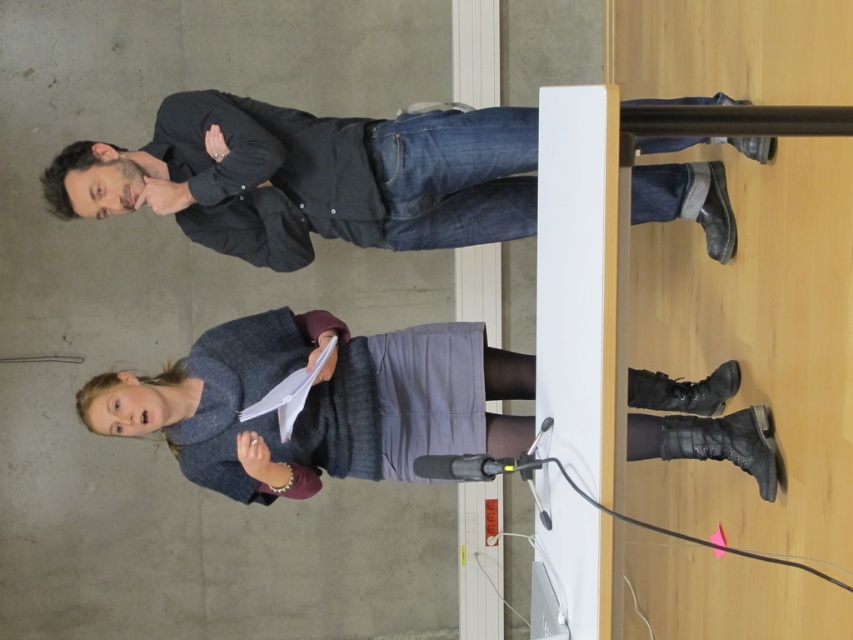
Is dark gray shirt at upper left bigger than gray wool skirt at center?

Actually, dark gray shirt at upper left might be smaller than gray wool skirt at center.

Is dark gray shirt at upper left smaller than gray wool skirt at center?

Indeed, dark gray shirt at upper left has a smaller size compared to gray wool skirt at center.

Who is more distant from viewer, (315,141) or (308,326)?

The point (308,326) is behind.

Where is `dark gray shirt at upper left`? dark gray shirt at upper left is located at coordinates (318, 177).